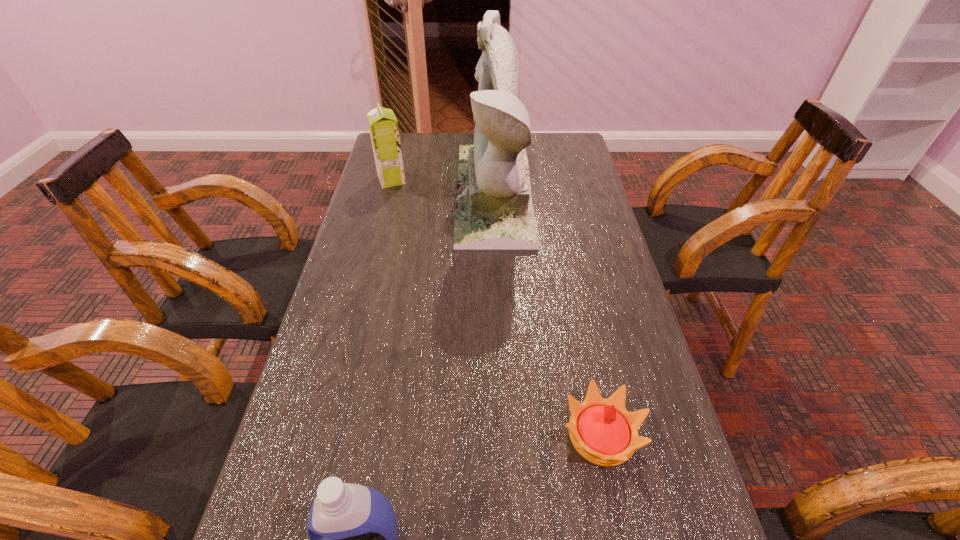
Find the location of a particular element. empty space between the second nearest object and the soya milk is located at coordinates (496, 308).

At what (x,y) coordinates should I click in order to perform the action: click on free space between the crown and the soya milk. Please return your answer as a coordinate pair (x, y). Looking at the image, I should click on (496, 308).

At what (x,y) coordinates should I click in order to perform the action: click on vacant area that lies between the sculpture and the third farthest object. Please return your answer as a coordinate pair (x, y). This screenshot has height=540, width=960. Looking at the image, I should click on pyautogui.click(x=547, y=315).

Locate which object ranks third in proximity to the soya milk. Please provide its 2D coordinates. Your answer should be formatted as a tuple, i.e. [(x, y)], where the tuple contains the x and y coordinates of a point satisfying the conditions above.

[(353, 533)]

Select which object is the closest to the sculpture. Please provide its 2D coordinates. Your answer should be formatted as a tuple, i.e. [(x, y)], where the tuple contains the x and y coordinates of a point satisfying the conditions above.

[(383, 126)]

Locate an element on the screen. The width and height of the screenshot is (960, 540). vacant space that satisfies the following two spatial constraints: 1. on the base of the shortest object; 2. on the left side of the sculpture is located at coordinates (504, 435).

The image size is (960, 540). In order to click on vacant area in the image that satisfies the following two spatial constraints: 1. on the base of the third farthest object; 2. on the left side of the tallest object in this screenshot , I will do `click(504, 435)`.

The width and height of the screenshot is (960, 540). I want to click on free location that satisfies the following two spatial constraints: 1. on the back side of the crown; 2. on the base of the tallest object, so click(x=553, y=195).

Where is `vacant space that satisfies the following two spatial constraints: 1. on the base of the crown; 2. on the right side of the sculpture`? The height and width of the screenshot is (540, 960). vacant space that satisfies the following two spatial constraints: 1. on the base of the crown; 2. on the right side of the sculpture is located at coordinates (504, 435).